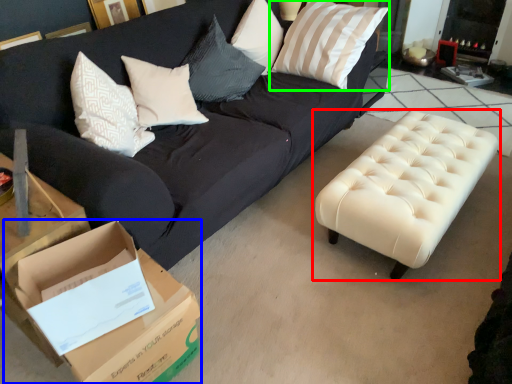
Question: Which object is the farthest from table (highlighted by a red box)? Choose among these: cardboard box (highlighted by a blue box) or pillow (highlighted by a green box).

Choices:
 (A) cardboard box
 (B) pillow

Answer: (A)